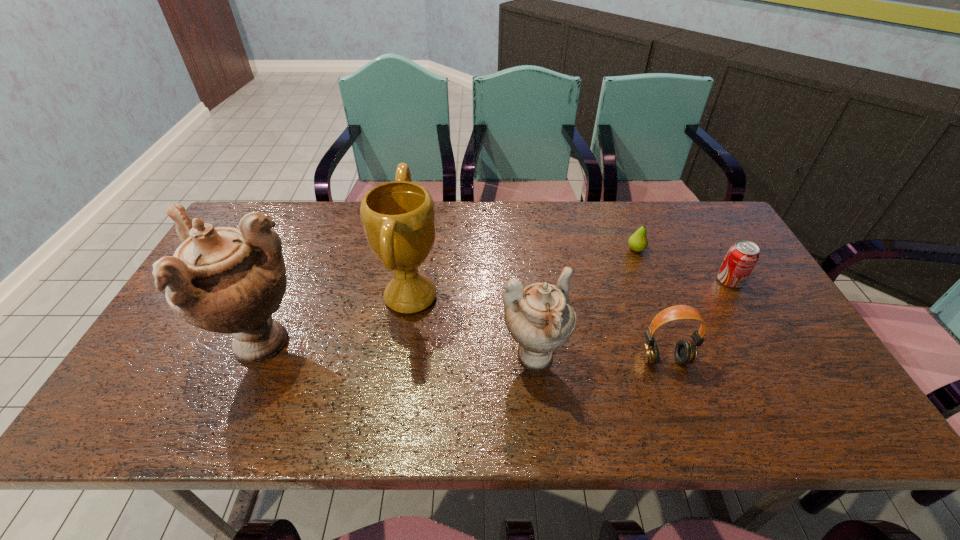
Given the evenly spaced urns in the image, where should an extra urn be added on the right to preserve the spacing? Please point to a vacant space. Please provide its 2D coordinates. Your answer should be formatted as a tuple, i.e. [(x, y)], where the tuple contains the x and y coordinates of a point satisfying the conditions above.

[(824, 373)]